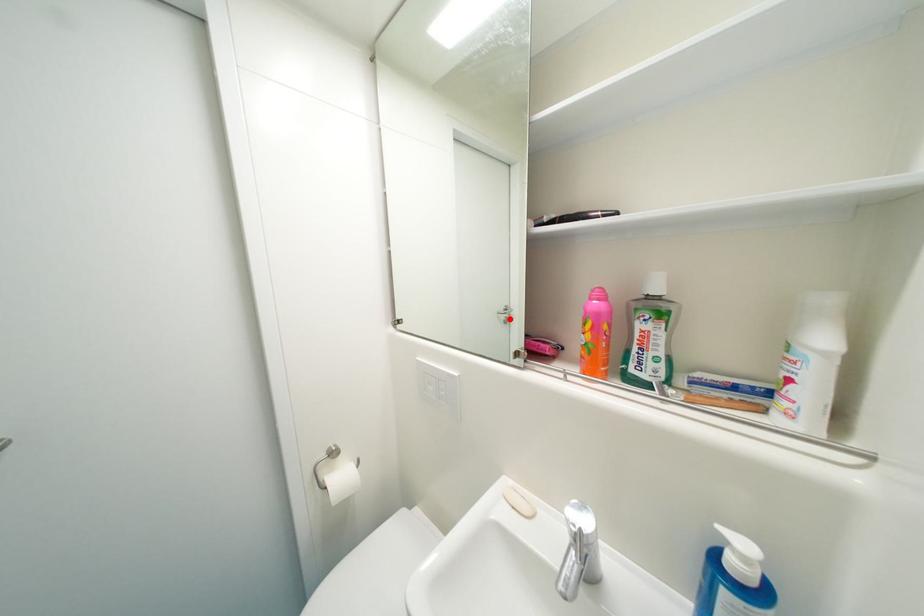
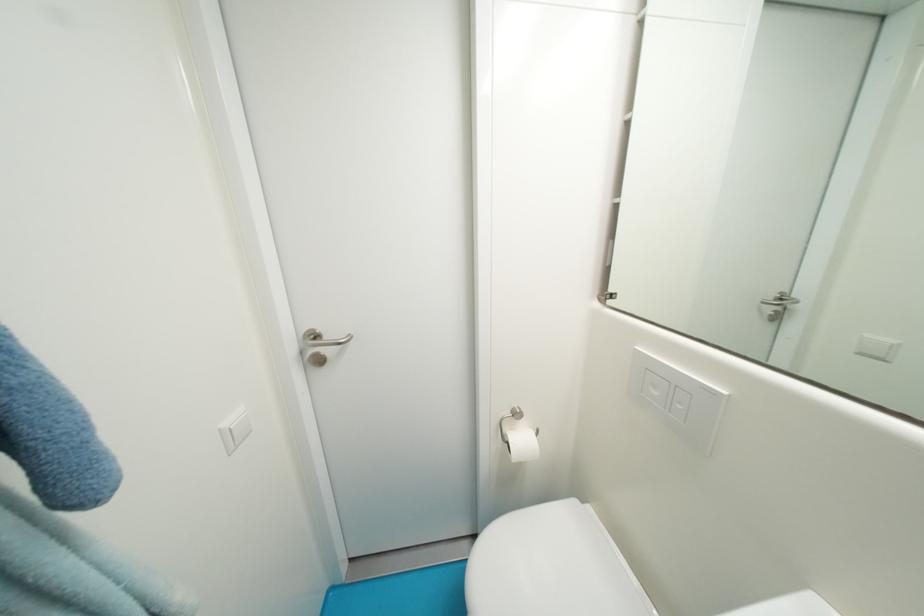
Locate, in the second image, the point that corresponds to the highlighted location in the first image.

(777, 312)